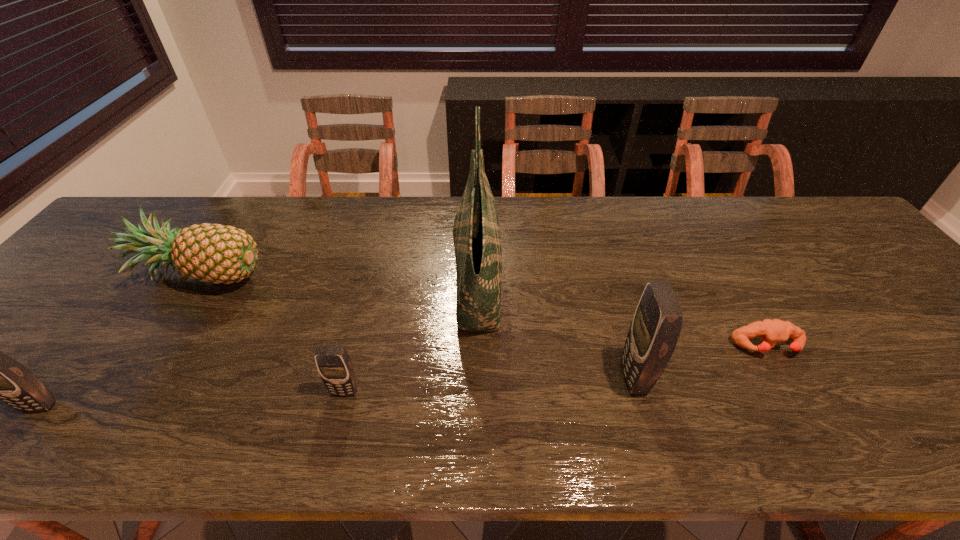
Locate which object ranks third in proximity to the second shortest cellular telephone. Please provide its 2D coordinates. Your answer should be formatted as a tuple, i.e. [(x, y)], where the tuple contains the x and y coordinates of a point satisfying the conditions above.

[(477, 242)]

Locate an element on the screen. This screenshot has width=960, height=540. the fourth closest object relative to the tallest object is located at coordinates (770, 331).

The image size is (960, 540). Find the location of `cellular telephone identified as the second closest to the pineapple`. cellular telephone identified as the second closest to the pineapple is located at coordinates (334, 365).

This screenshot has height=540, width=960. I want to click on cellular telephone that stands as the closest to the rightmost object, so click(x=658, y=320).

At what (x,y) coordinates should I click in order to perform the action: click on free spot that satisfies the following two spatial constraints: 1. on the front face of the tallest cellular telephone; 2. on the front face of the fourth object from right to left. Please return your answer as a coordinate pair (x, y). This screenshot has height=540, width=960. Looking at the image, I should click on (638, 392).

At what (x,y) coordinates should I click in order to perform the action: click on free region that satisfies the following two spatial constraints: 1. on the front face of the rightmost cellular telephone; 2. on the front face of the leftmost cellular telephone. Please return your answer as a coordinate pair (x, y). This screenshot has width=960, height=540. Looking at the image, I should click on (642, 406).